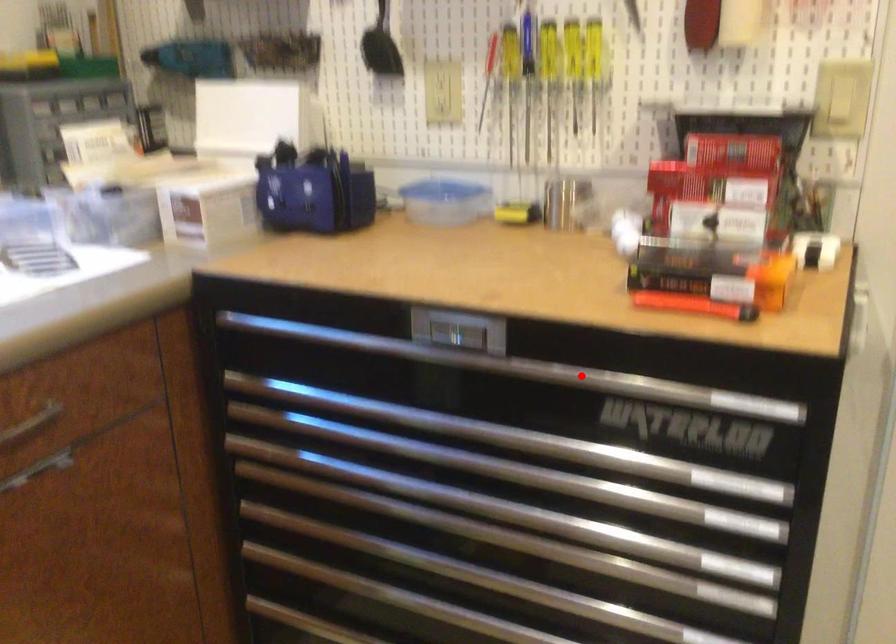
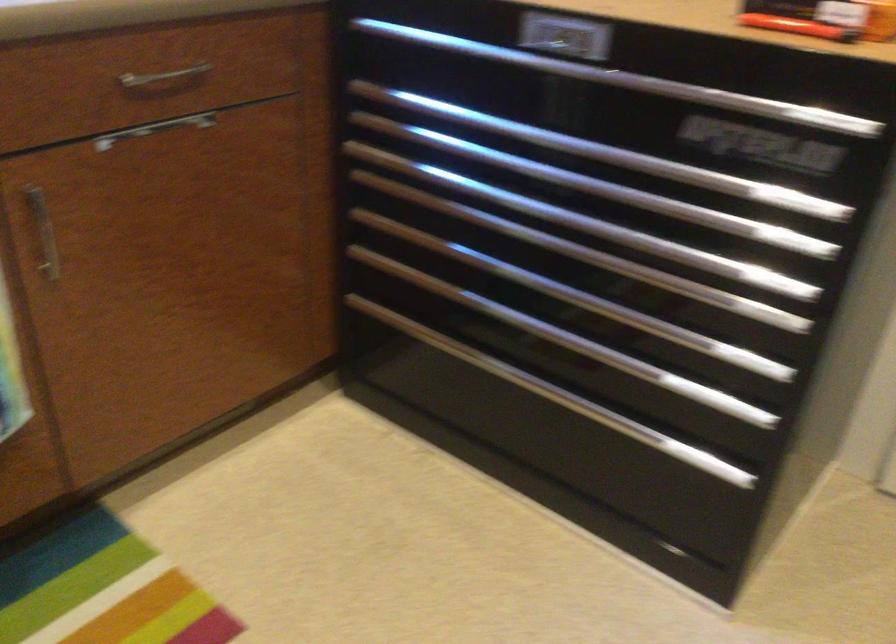
In the second image, find the point that corresponds to the highlighted location in the first image.

(668, 88)